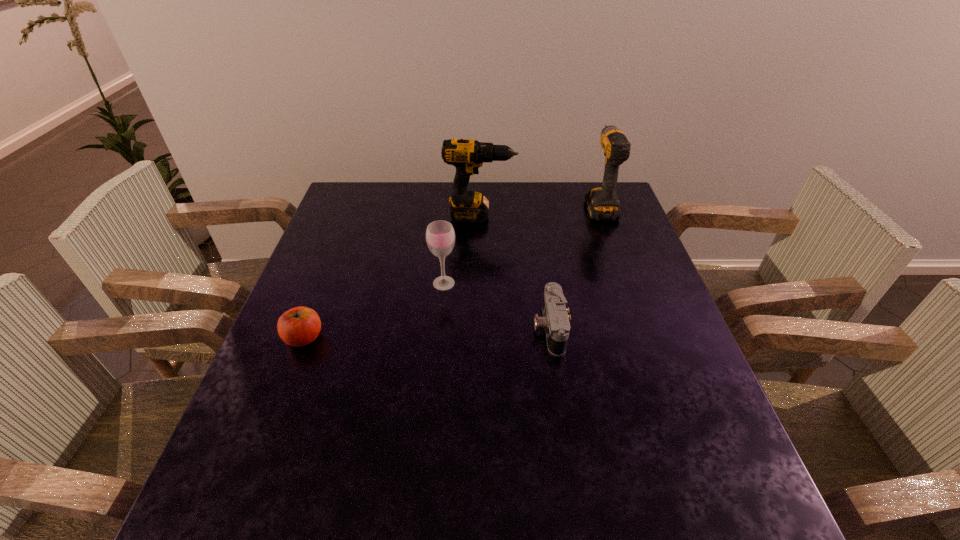
Find the location of a particular element. free space located 0.160m on the lens of the second object from right to left is located at coordinates (465, 328).

You are a GUI agent. You are given a task and a screenshot of the screen. Output one action in this format:
    pyautogui.click(x=<x>, y=<y>)
    Task: Click on the vacant region located on the lens of the second object from right to left
    This screenshot has width=960, height=540.
    Given the screenshot: What is the action you would take?
    pyautogui.click(x=371, y=328)

Locate an element on the screen. Image resolution: width=960 pixels, height=540 pixels. object situated at the left edge is located at coordinates (299, 326).

The width and height of the screenshot is (960, 540). I want to click on object at the right edge, so click(x=602, y=203).

I want to click on object that is at the far right corner, so click(602, 203).

Find the location of a particular element. This screenshot has height=540, width=960. blank space at the far edge of the desktop is located at coordinates (505, 183).

You are a GUI agent. You are given a task and a screenshot of the screen. Output one action in this format:
    pyautogui.click(x=<x>, y=<y>)
    Task: Click on the free space at the near edge of the desktop
    This screenshot has height=540, width=960.
    Given the screenshot: What is the action you would take?
    pyautogui.click(x=336, y=529)

Find the location of a particular element. This screenshot has width=960, height=540. blank space at the left edge of the desktop is located at coordinates (277, 362).

At what (x,y) coordinates should I click in order to perform the action: click on blank space at the right edge of the desktop. Please return your answer as a coordinate pair (x, y). This screenshot has width=960, height=540. Looking at the image, I should click on (662, 388).

Locate an element on the screen. Image resolution: width=960 pixels, height=540 pixels. vacant space at the far left corner of the desktop is located at coordinates (350, 205).